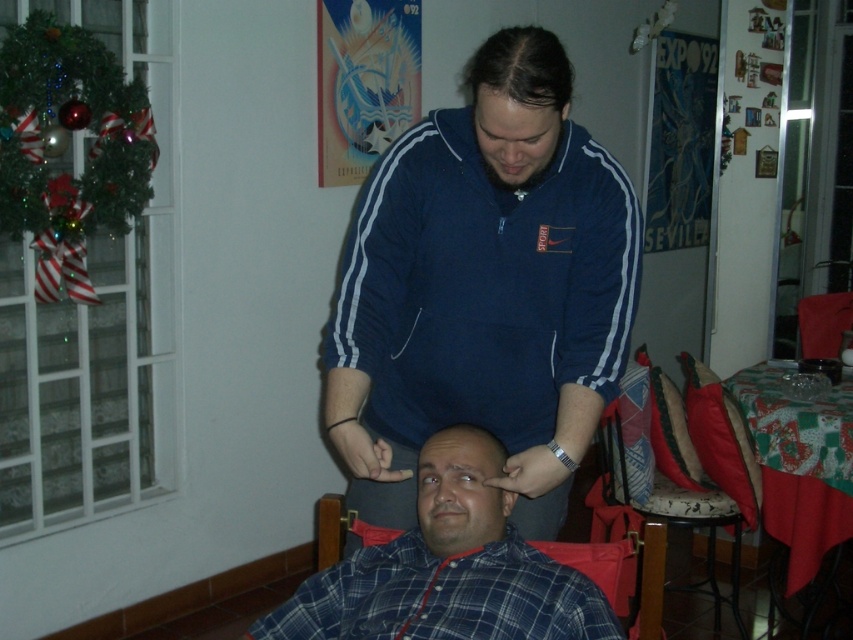
In the scene shown: You are a photographer taking a portrait of the two people in the scene. You need to ensure the blue plaid shirt at center and the dark brown hair at center are both visible in the frame. Based on their positions, which one should be closer to the bottom of the photo?

The blue plaid shirt at center is positioned under dark brown hair at center, so it should be closer to the bottom of the photo.

You are a photographer taking a picture of the blue plaid shirt at center and the dark brown hair at center. Which object should you focus on first to ensure both are in sharp focus?

The blue plaid shirt at center is closer to the viewer than the dark brown hair at center. To ensure both are in sharp focus, you should focus on the dark brown hair at center first since it is farther away, as depth of field extends behind the point of focus.

You are standing in the room and want to reach the point at coordinates point (x=679, y=442). If you can move forward 9 feet, will you be able to reach it?

The point (x=679, y=442) is 9.74 feet away from the viewer. Since you can move forward 9 feet, you will not be able to reach it as you need to cover an additional 0.74 feet.